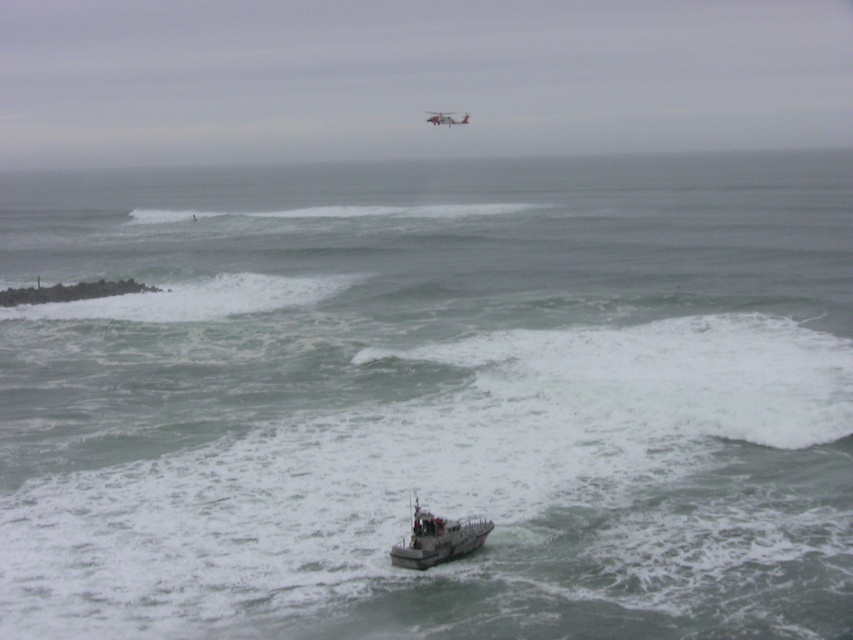
Based on the photo, you are a rescue coordinator trying to direct a drone to the metallic gray helicopter at upper center from the gray metallic boat at center. The drone has a maximum range of 200 feet. Can the drone reach the helicopter?

The distance between the gray metallic boat at center and the metallic gray helicopter at upper center is 226.69 feet, which exceeds the drone maximum range of 200 feet. Therefore, the drone cannot reach the helicopter.

You are a marine biologist observing the scene from a nearby research station. You notice the gray metallic boat at center and the metallic gray helicopter at upper center. Which object appears smaller in the image?

The gray metallic boat at center appears smaller compared to the metallic gray helicopter at upper center.